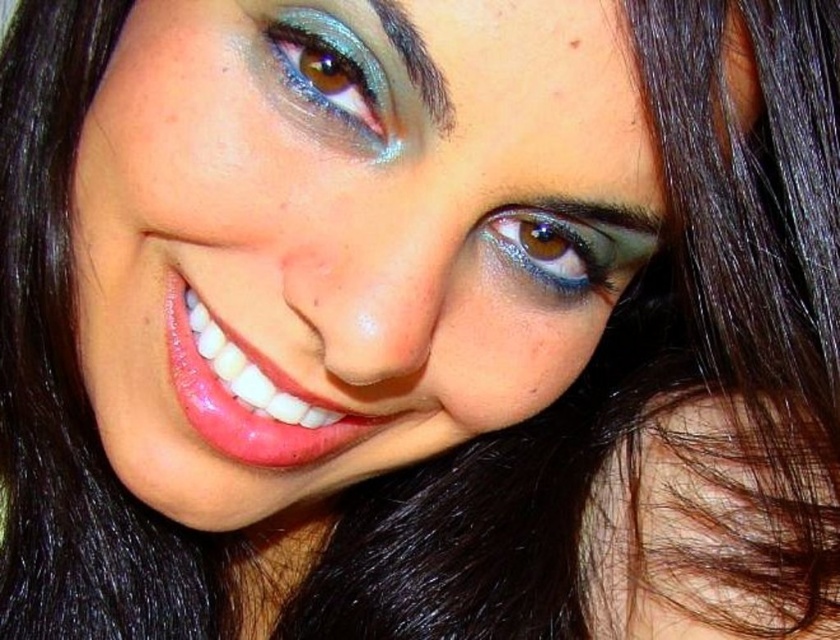
Question: Is shiny teal eyeshadow at upper center positioned in front of shiny brown eye at upper center?

Choices:
 (A) yes
 (B) no

Answer: (A)

Question: Among these points, which one is nearest to the camera?

Choices:
 (A) (431, 96)
 (B) (578, 252)

Answer: (A)

Question: Does shiny teal eyeshadow at upper center have a greater width compared to sleek dark brown eyebrow at upper center?

Choices:
 (A) yes
 (B) no

Answer: (A)

Question: Is sleek dark brown eyebrow at upper center positioned before brown matte freckle at upper center?

Choices:
 (A) no
 (B) yes

Answer: (B)

Question: Which of the following is the closest to the observer?

Choices:
 (A) (403, 40)
 (B) (365, 67)

Answer: (A)

Question: Which of these objects is positioned farthest from the shiny brown eye at upper center?

Choices:
 (A) brown matte freckle at upper center
 (B) shiny teal eyeshadow at upper center
 (C) sleek dark brown eyebrow at upper center

Answer: (A)